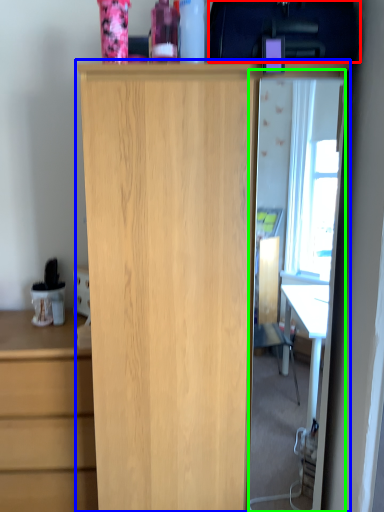
Question: Which object is the closest to the back (highlighted by a red box)? Choose among these: cupboard (highlighted by a blue box) or glass door (highlighted by a green box).

Choices:
 (A) cupboard
 (B) glass door

Answer: (A)